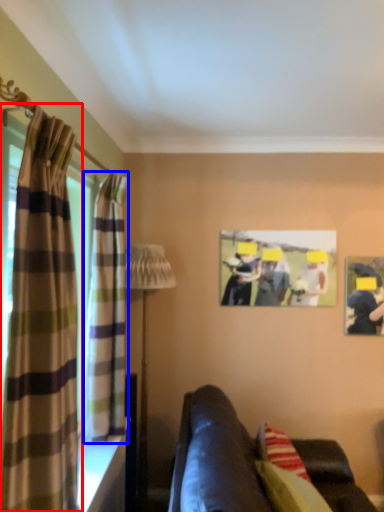
Question: Which point is further to the camera, curtain (highlighted by a red box) or curtain (highlighted by a blue box)?

Choices:
 (A) curtain
 (B) curtain

Answer: (B)